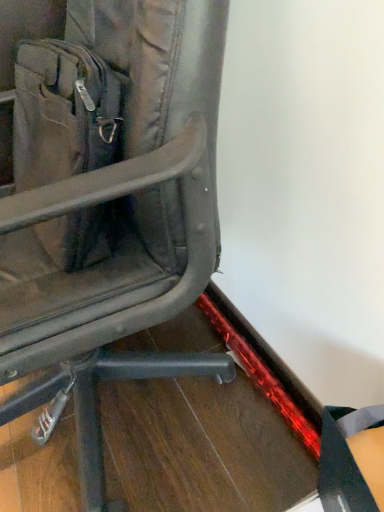
Question: From a real-world perspective, is matte black chair at center physically located above or below matte black messenger bag at left?

Choices:
 (A) above
 (B) below

Answer: (B)

Question: From their relative heights in the image, would you say matte black chair at center is taller or shorter than matte black messenger bag at left?

Choices:
 (A) short
 (B) tall

Answer: (B)

Question: In terms of width, does matte black chair at center look wider or thinner when compared to matte black messenger bag at left?

Choices:
 (A) wide
 (B) thin

Answer: (A)

Question: Do you think matte black messenger bag at left is within matte black chair at center, or outside of it?

Choices:
 (A) outside
 (B) inside

Answer: (B)

Question: Based on their sizes in the image, would you say matte black messenger bag at left is bigger or smaller than matte black chair at center?

Choices:
 (A) small
 (B) big

Answer: (A)

Question: Is point coord(43,224) positioned closer to the camera than point coord(46,197)?

Choices:
 (A) closer
 (B) farther

Answer: (B)

Question: In terms of width, does matte black messenger bag at left look wider or thinner when compared to matte black chair at center?

Choices:
 (A) thin
 (B) wide

Answer: (A)